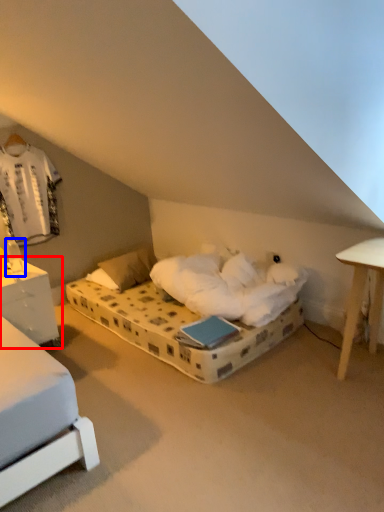
Question: Which point is further to the camera, nightstand (highlighted by a red box) or table lamp (highlighted by a blue box)?

Choices:
 (A) nightstand
 (B) table lamp

Answer: (B)